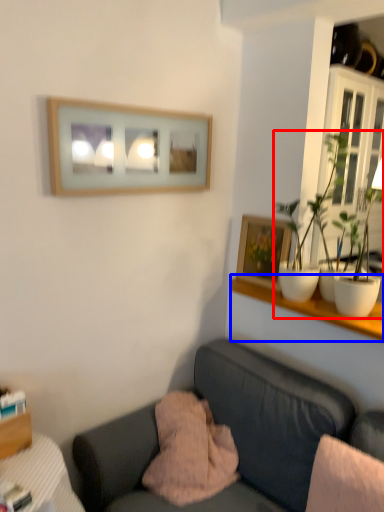
Question: Among these objects, which one is nearest to the camera, houseplant (highlighted by a red box) or shelf (highlighted by a blue box)?

Choices:
 (A) houseplant
 (B) shelf

Answer: (A)